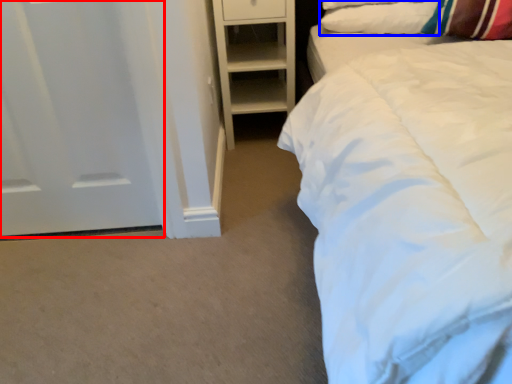
Question: Which point is further to the camera, door (highlighted by a red box) or pillow (highlighted by a blue box)?

Choices:
 (A) door
 (B) pillow

Answer: (B)